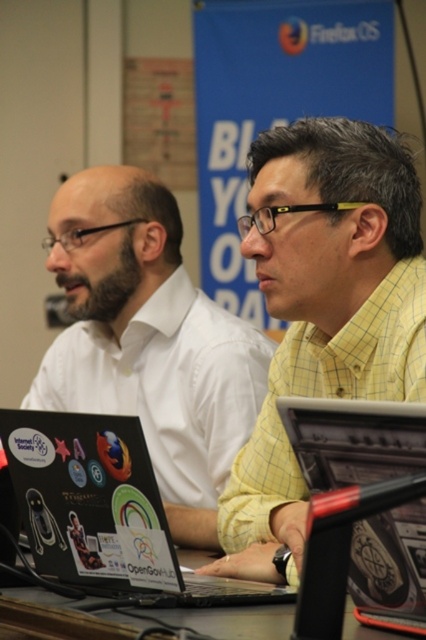
You are a photographer standing 20 inches away from the two people. You want to take a photo of both the yellow checkered shirt at center and the white glossy shirt at left in the same frame. Is it possible?

The yellow checkered shirt at center and white glossy shirt at left are 19.75 inches apart from each other. Since you are standing 20 inches away from them, the distance between the shirts is less than your distance, so it is possible to capture both in the same frame.

You are a photographer standing in front of the table. You want to take a photo that includes both the yellow checkered shirt at center and the metallic silver laptop at center. Which object should you focus on first to ensure both are in clear view?

The yellow checkered shirt at center is further to the viewer than the metallic silver laptop at center, so you should focus on the yellow checkered shirt at center first to ensure both are in clear view.

You are a photographer taking a picture of the yellow checkered shirt at center and the metallic silver laptop at center. To ensure both are in frame, should you adjust your camera to the left or right of the current position?

The yellow checkered shirt at center is to the left of the metallic silver laptop at center, so you should adjust your camera to the right to ensure both are in frame.